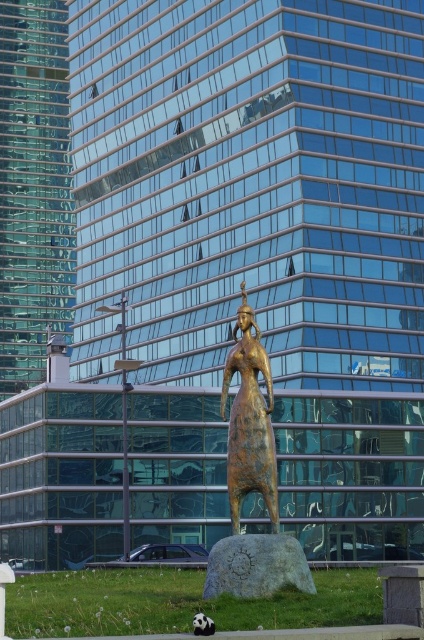
Which is in front, point (264, 369) or point (203, 593)?

Point (264, 369) is in front.

Where is `bronze statue at center`? This screenshot has width=424, height=640. bronze statue at center is located at coordinates (250, 420).